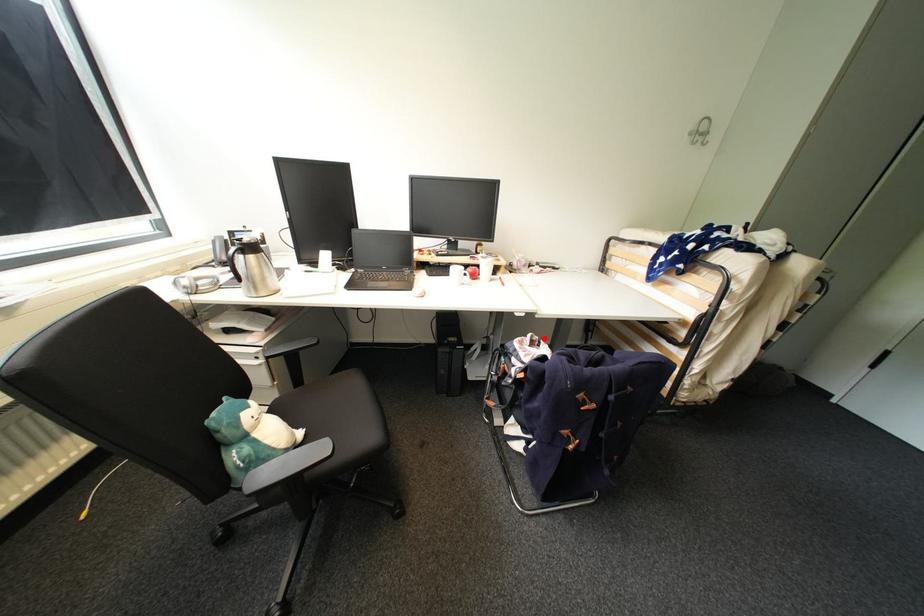
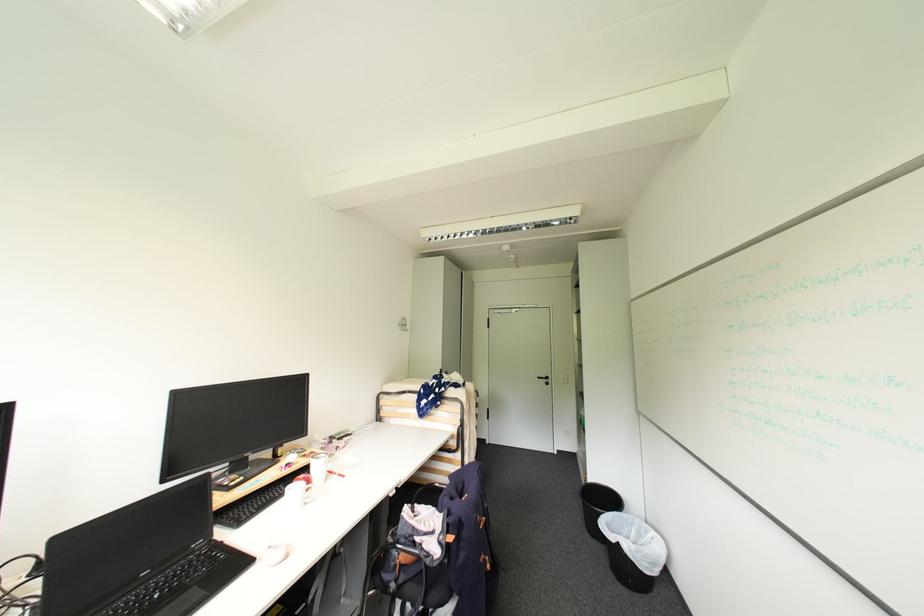
Question: I am providing you with two images of the same scene from different viewpoints. A red point is shown in image1. For the corresponding object point in image2, is it positioned nearer or farther from the camera?

Choices:
 (A) Nearer
 (B) Farther

Answer: (A)